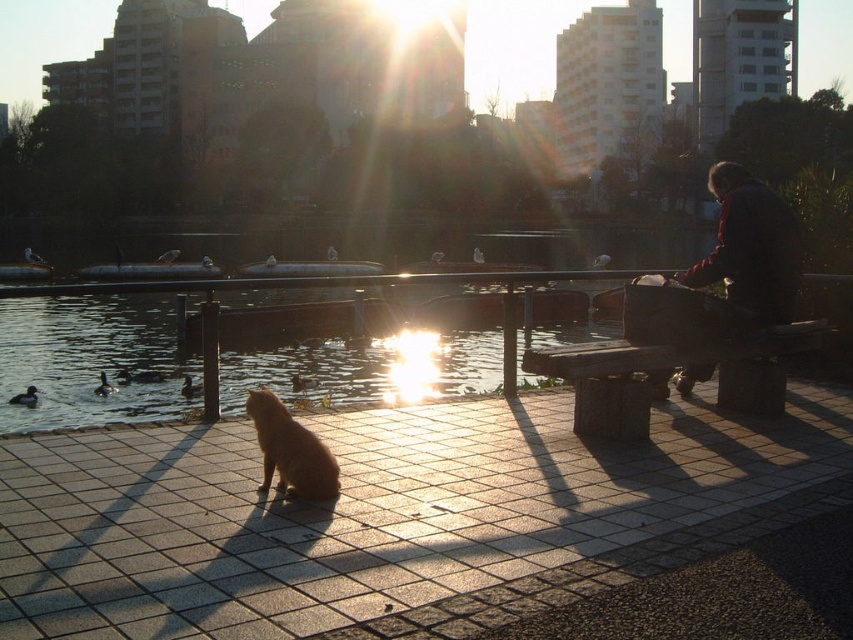
Does wooden bench at right have a lesser height compared to golden fur cat at center?

No.

Is wooden bench at right below golden fur cat at center?

Actually, wooden bench at right is above golden fur cat at center.

Find the location of a particular element. This screenshot has width=853, height=640. wooden bench at right is located at coordinates (670, 369).

Does clear water at bench right appear on the right side of dark brown leather jacket at upper right?

Incorrect, clear water at bench right is not on the right side of dark brown leather jacket at upper right.

Where is `clear water at bench right`? Image resolution: width=853 pixels, height=640 pixels. clear water at bench right is located at coordinates (393, 348).

Between point (4, 448) and point (320, 445), which one is positioned behind?

The point (4, 448) is more distant.

From the picture: Can you confirm if smooth stone dock at center is wider than golden fur cat at center?

Yes.

You are a GUI agent. You are given a task and a screenshot of the screen. Output one action in this format:
    pyautogui.click(x=<x>, y=<y>)
    Task: Click on the smooth stone dock at center
    The height and width of the screenshot is (640, 853).
    Given the screenshot: What is the action you would take?
    pyautogui.click(x=392, y=516)